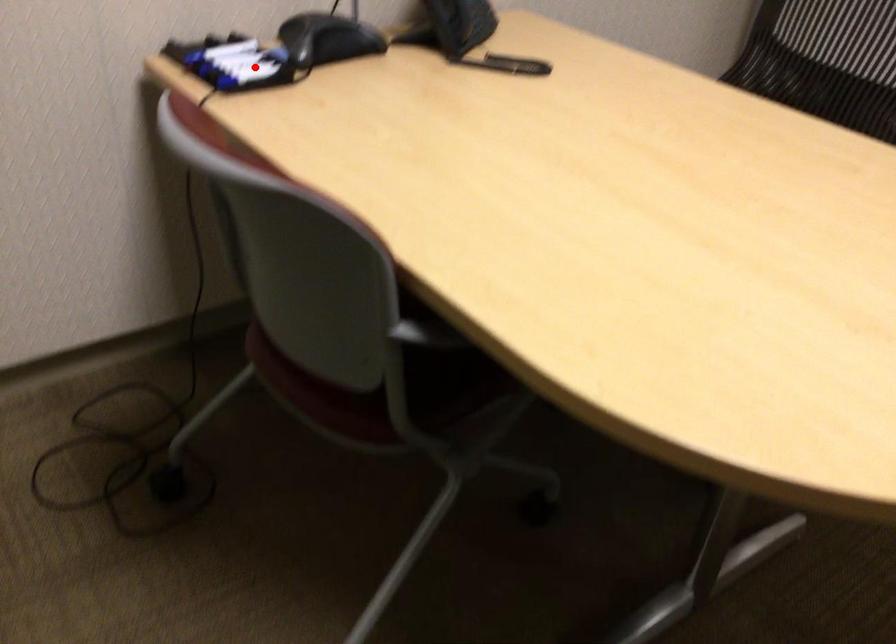
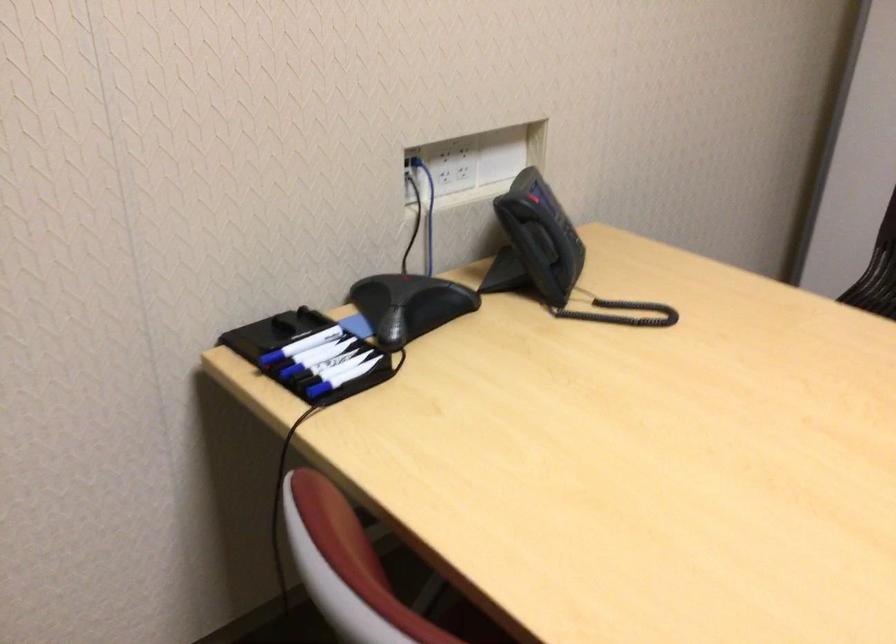
Locate, in the second image, the point that corresponds to the highlighted location in the first image.

(342, 363)